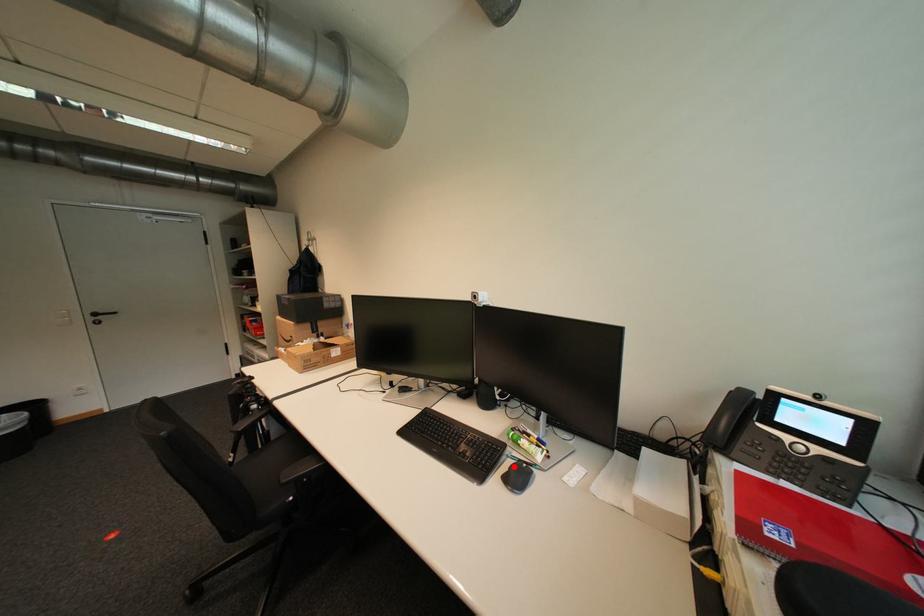
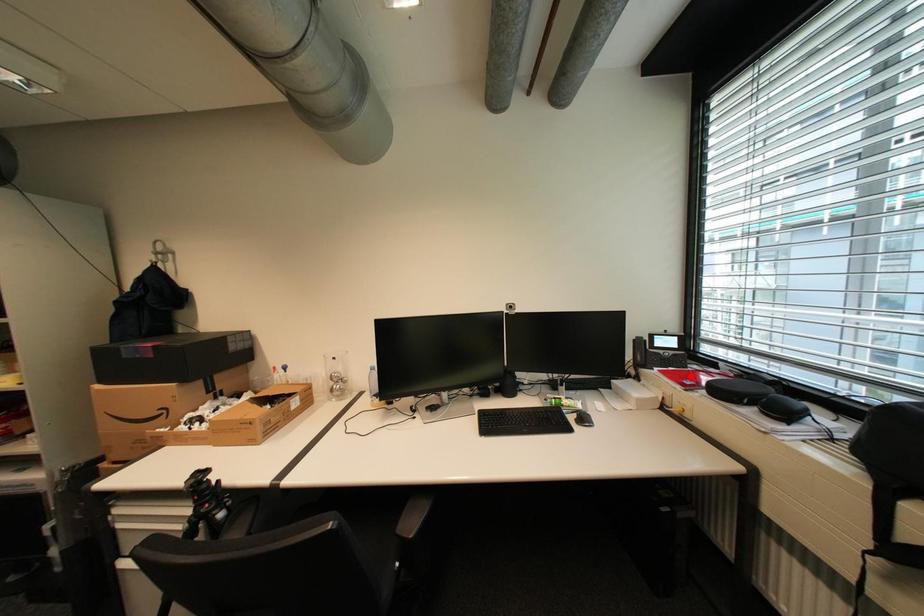
I am providing you with two images of the same scene from different viewpoints. A red point is marked on the first image and another point is marked on the second image. Is the red point in image1 aligned with the point shown in image2?

No